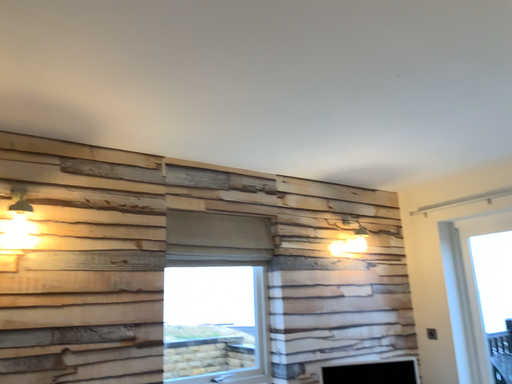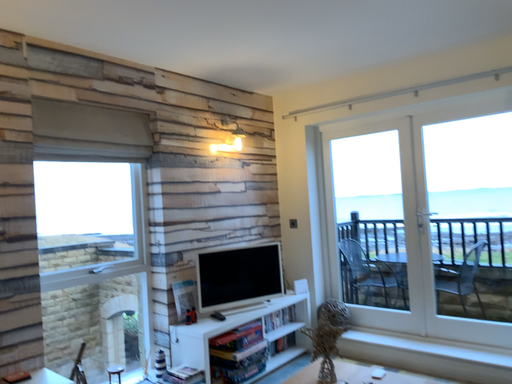
Question: How did the camera likely rotate when shooting the video?

Choices:
 (A) rotated downward
 (B) rotated upward

Answer: (A)